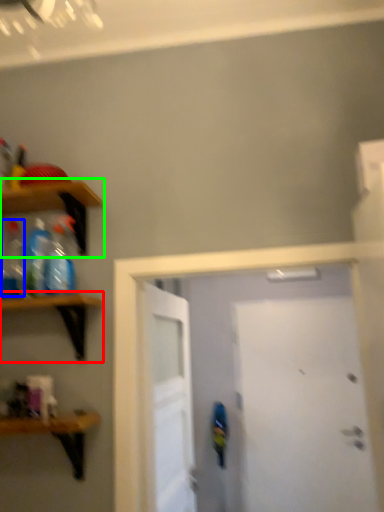
Question: Based on their relative distances, which object is nearer to shelf (highlighted by a red box)? Choose from bottle (highlighted by a blue box) and shelf (highlighted by a green box).

Choices:
 (A) bottle
 (B) shelf

Answer: (A)